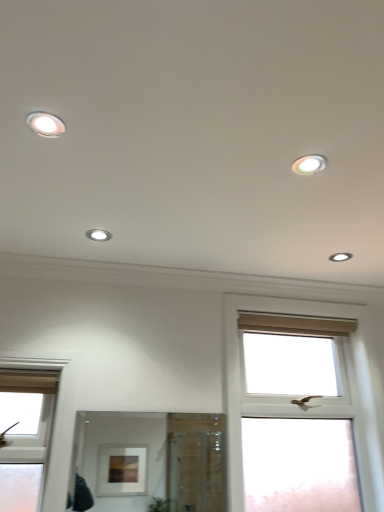
Question: Does white glossy light fixture at upper right, the 1th dot positioned from the top, have a lesser width compared to white glossy light fixture at upper right, placed as the 3th dot when sorted from top to bottom?

Choices:
 (A) no
 (B) yes

Answer: (A)

Question: Is white glossy light fixture at upper right, which appears as the second dot when viewed from the left, wider than white glossy light fixture at upper right, the first dot positioned from the back?

Choices:
 (A) yes
 (B) no

Answer: (A)

Question: Is the surface of white glossy light fixture at upper right, the third dot when ordered from back to front, in direct contact with white glossy light fixture at upper right, which is the 1th dot from bottom to top?

Choices:
 (A) no
 (B) yes

Answer: (A)

Question: Is white glossy light fixture at upper right, positioned as the third dot in left-to-right order, inside white glossy light fixture at upper right, marked as the third dot in a bottom-to-top arrangement?

Choices:
 (A) yes
 (B) no

Answer: (B)

Question: Is white glossy light fixture at upper right, the 1th dot positioned from the top, at the right side of white glossy light fixture at upper right, the first dot positioned from the back?

Choices:
 (A) yes
 (B) no

Answer: (B)

Question: Which is correct: white glossy light fixture at center, which is the 1th dot from left to right, is inside white plastic window at center right, the first window in the right-to-left sequence, or outside of it?

Choices:
 (A) inside
 (B) outside

Answer: (B)

Question: Is point (87, 234) positioned closer to the camera than point (367, 315)?

Choices:
 (A) farther
 (B) closer

Answer: (B)

Question: In the image, is white glossy light fixture at center, the third dot from the right, on the left side or the right side of white plastic window at center right, the first window in the right-to-left sequence?

Choices:
 (A) right
 (B) left

Answer: (B)

Question: In terms of size, does white glossy light fixture at center, which appears as the second dot when ordered from the bottom, appear bigger or smaller than white plastic window at center right, the first window in the right-to-left sequence?

Choices:
 (A) big
 (B) small

Answer: (B)

Question: Based on their sizes in the image, would you say white glossy light fixture at center, which ranks as the 2th dot in top-to-bottom order, is bigger or smaller than white glossy light fixture at upper right, positioned as the third dot in left-to-right order?

Choices:
 (A) big
 (B) small

Answer: (A)

Question: From their relative heights in the image, would you say white glossy light fixture at center, which ranks as the 2th dot in top-to-bottom order, is taller or shorter than white glossy light fixture at upper right, the third dot when ordered from front to back?

Choices:
 (A) short
 (B) tall

Answer: (A)

Question: From a real-world perspective, is white glossy light fixture at center, which ranks as the 2th dot in top-to-bottom order, physically located above or below white glossy light fixture at upper right, placed as the 3th dot when sorted from top to bottom?

Choices:
 (A) above
 (B) below

Answer: (B)

Question: Choose the correct answer: Is white glossy light fixture at center, which is the 1th dot from left to right, inside white glossy light fixture at upper right, the third dot when ordered from front to back, or outside it?

Choices:
 (A) outside
 (B) inside

Answer: (A)

Question: Would you say clear glass mirror at center is to the left or to the right of white glossy light fixture at upper right, the 2th dot positioned from the right, in the picture?

Choices:
 (A) right
 (B) left

Answer: (B)

Question: In terms of width, does clear glass mirror at center look wider or thinner when compared to white glossy light fixture at upper right, the third dot when ordered from back to front?

Choices:
 (A) wide
 (B) thin

Answer: (B)